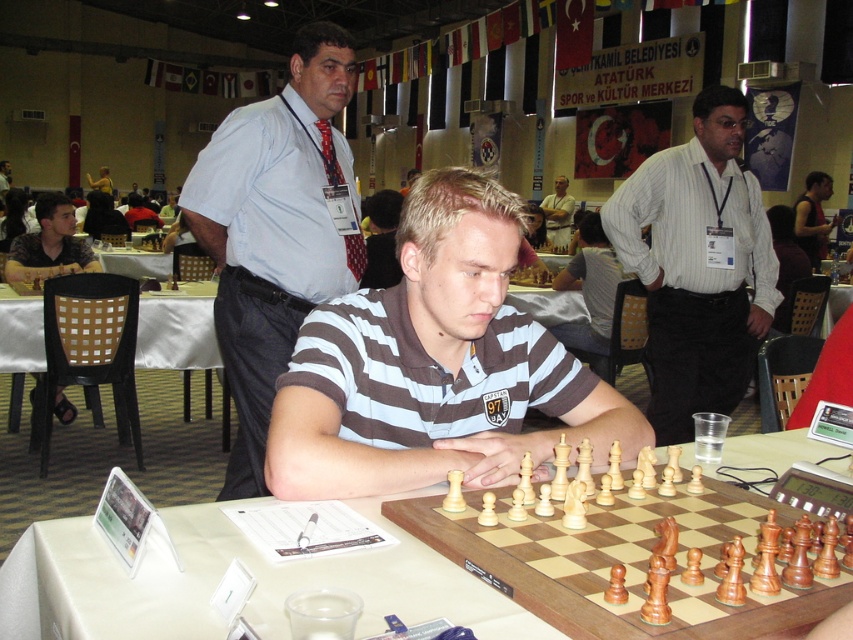
In the scene shown: Who is positioned more to the left, wooden chess set at center or matte gray shirt at center?

From the viewer's perspective, matte gray shirt at center appears more on the left side.

Does point (593, 524) come in front of point (3, 182)?

That is True.

I want to click on wooden chess set at center, so click(x=648, y=554).

Who is more forward, (717,232) or (9,188)?

Point (717,232)

Who is more forward, (706, 321) or (10, 170)?

Point (706, 321) is more forward.

Identify the location of white striped shirt at center. (697, 264).

Does wooden chess set at center have a lesser width compared to matte black shirt at left?

No, wooden chess set at center is not thinner than matte black shirt at left.

Where is `wooden chess set at center`? The height and width of the screenshot is (640, 853). wooden chess set at center is located at coordinates (648, 554).